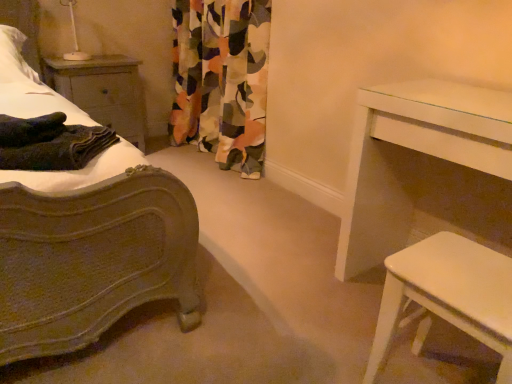
Question: Would you say multicolored fabric curtain at center contains dark green textured blanket at left?

Choices:
 (A) yes
 (B) no

Answer: (B)

Question: Does multicolored fabric curtain at center have a smaller size compared to dark green textured blanket at left?

Choices:
 (A) no
 (B) yes

Answer: (A)

Question: Can you confirm if multicolored fabric curtain at center is thinner than dark green textured blanket at left?

Choices:
 (A) yes
 (B) no

Answer: (A)

Question: From a real-world perspective, is multicolored fabric curtain at center on dark green textured blanket at left?

Choices:
 (A) no
 (B) yes

Answer: (A)

Question: Does multicolored fabric curtain at center appear on the left side of dark green textured blanket at left?

Choices:
 (A) yes
 (B) no

Answer: (B)

Question: Does multicolored fabric curtain at center have a lesser height compared to dark green textured blanket at left?

Choices:
 (A) yes
 (B) no

Answer: (B)

Question: Does dark green textured blanket at left lie in front of white glossy stool at lower right, which appears as the 1th table when viewed from the front?

Choices:
 (A) yes
 (B) no

Answer: (B)

Question: Is dark green textured blanket at left facing towards white glossy stool at lower right, which appears as the 1th table when viewed from the front?

Choices:
 (A) no
 (B) yes

Answer: (A)

Question: From the image's perspective, is dark green textured blanket at left located above white glossy stool at lower right, the 2th table viewed from the back?

Choices:
 (A) no
 (B) yes

Answer: (B)

Question: Are dark green textured blanket at left and white glossy stool at lower right, the 2th table viewed from the back, making contact?

Choices:
 (A) yes
 (B) no

Answer: (B)

Question: From a real-world perspective, is dark green textured blanket at left located beneath white glossy stool at lower right, which appears as the 1th table when viewed from the front?

Choices:
 (A) no
 (B) yes

Answer: (A)

Question: From the image's perspective, is dark green textured blanket at left located beneath white glossy stool at lower right, which appears as the 1th table when viewed from the front?

Choices:
 (A) yes
 (B) no

Answer: (B)

Question: Can you confirm if white glossy stool at lower right, the 2th table viewed from the back, is shorter than white glossy table at right, which is the first table from back to front?

Choices:
 (A) no
 (B) yes

Answer: (B)